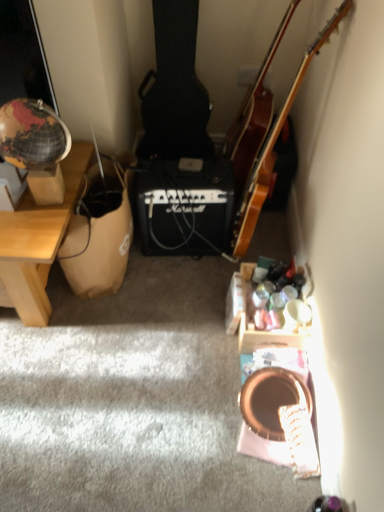
Question: Do you think wooden acoustic guitar at upper right is within brown paper bag at left, or outside of it?

Choices:
 (A) outside
 (B) inside

Answer: (A)

Question: In terms of size, does wooden acoustic guitar at upper right appear bigger or smaller than brown paper bag at left?

Choices:
 (A) small
 (B) big

Answer: (B)

Question: Which object is positioned farthest from the wooden desk at left?

Choices:
 (A) brown paper bag at left
 (B) wooden acoustic guitar at upper right
 (C) wooden acoustic guitar at upper right

Answer: (C)

Question: Considering the real-world distances, which object is farthest from the wooden desk at left?

Choices:
 (A) wooden acoustic guitar at upper right
 (B) brown paper bag at left
 (C) wooden acoustic guitar at upper right

Answer: (A)